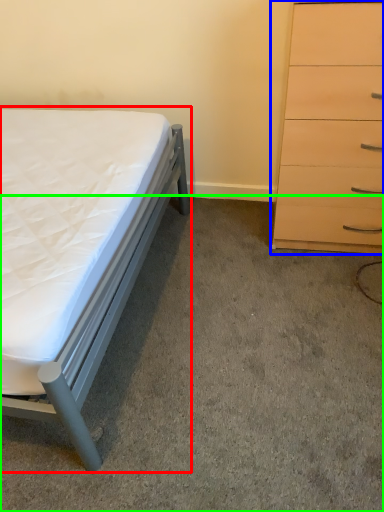
Question: Which is farther away from bed (highlighted by a red box)? chest of drawers (highlighted by a blue box) or concrete (highlighted by a green box)?

Choices:
 (A) chest of drawers
 (B) concrete

Answer: (A)